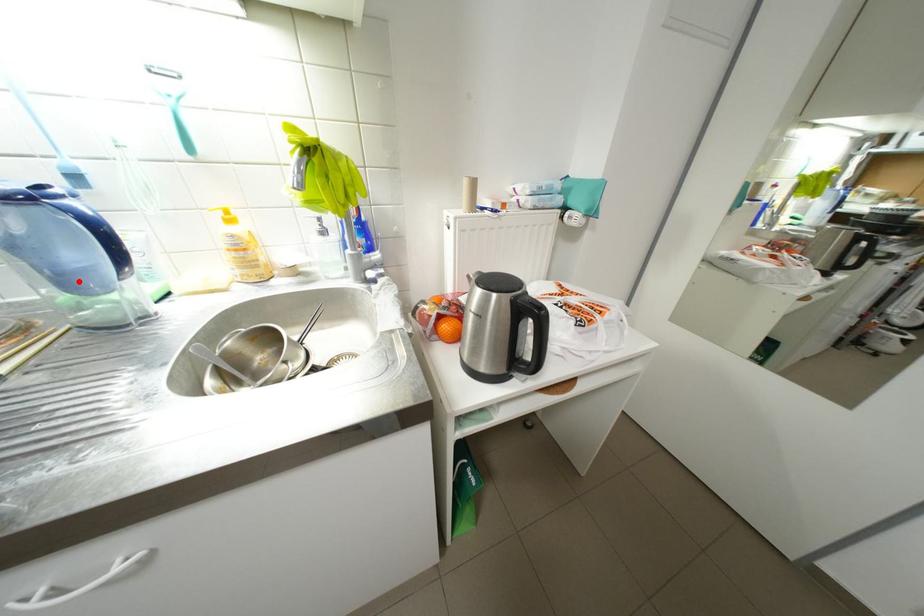
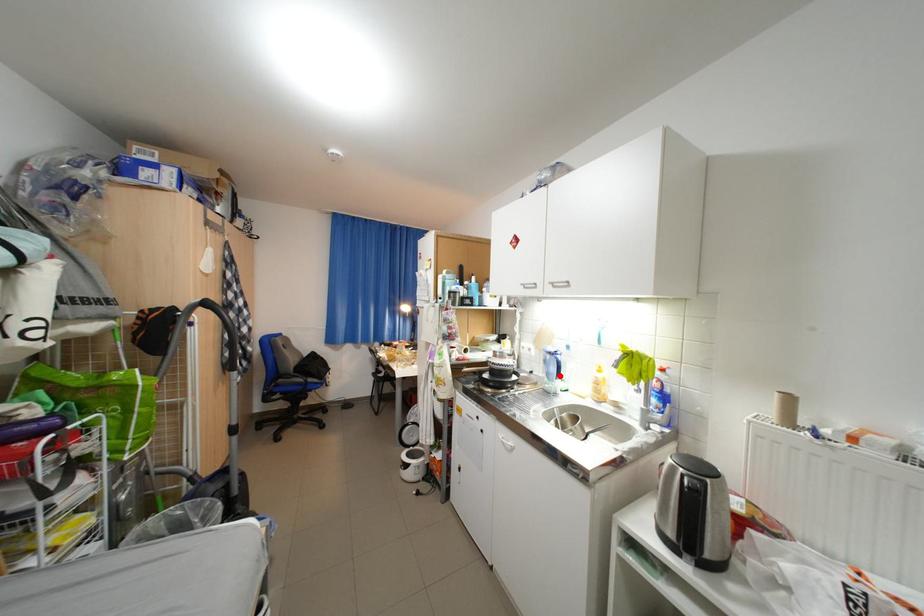
I am providing you with two images of the same scene from different viewpoints. A red point is marked on the first image and another point is marked on the second image. Is the marked point in image1 the same physical position as the marked point in image2?

Yes